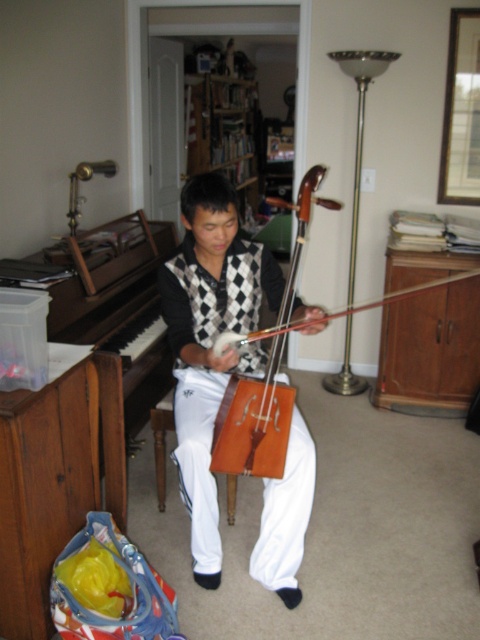
Question: Which point is farther to the camera?

Choices:
 (A) (280, 422)
 (B) (284, 385)
 (C) (155, 456)

Answer: (C)

Question: Does wooden violin at center have a smaller size compared to brown polished wood piano at left?

Choices:
 (A) no
 (B) yes

Answer: (B)

Question: Which object is positioned farthest from the brown polished wood piano at left?

Choices:
 (A) wooden cello at center
 (B) brown matte violin at center

Answer: (B)

Question: Does wooden violin at center have a smaller size compared to wooden cello at center?

Choices:
 (A) no
 (B) yes

Answer: (A)

Question: Does wooden violin at center have a lesser width compared to wooden cello at center?

Choices:
 (A) yes
 (B) no

Answer: (B)

Question: Which of these objects is positioned farthest from the brown wood stool at lower center?

Choices:
 (A) wooden violin at center
 (B) brown matte violin at center
 (C) brown polished wood piano at left
 (D) wooden cello at center

Answer: (C)